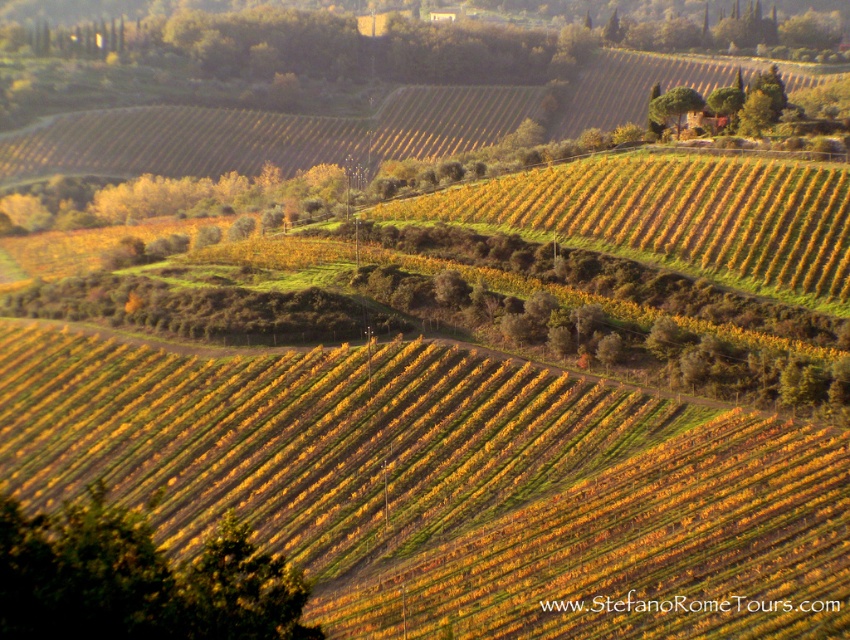
From the picture: Between green leafy tree at lower left and green leafy tree at upper center, which one appears on the right side from the viewer's perspective?

From the viewer's perspective, green leafy tree at upper center appears more on the right side.

Between green leafy tree at lower left and green leafy tree at upper center, which one is positioned lower?

green leafy tree at lower left is lower down.

Does point (69, 545) come in front of point (678, 132)?

Yes, point (69, 545) is in front of point (678, 132).

The width and height of the screenshot is (850, 640). Identify the location of green leafy tree at lower left. (139, 579).